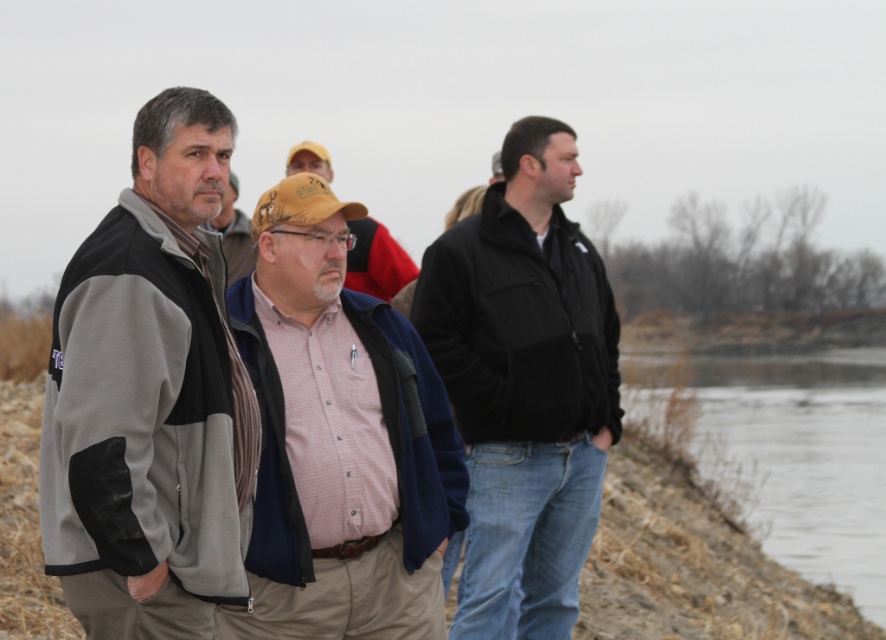
Where is the gray fleece jacket at left located in the image?

The gray fleece jacket at left is located at point 0.620 on the x axis and 0.170 on the y axis.

You are a photographer trying to capture a photo of the two men wearing the pink checkered shirt at center and the black fleece jacket at center. Since you want them to appear side by side in the frame, which one should you position to your left to ensure proper alignment?

To position them side by side properly, you should place the pink checkered shirt at center to your left since it is already on the left side of the black fleece jacket at center in the image.